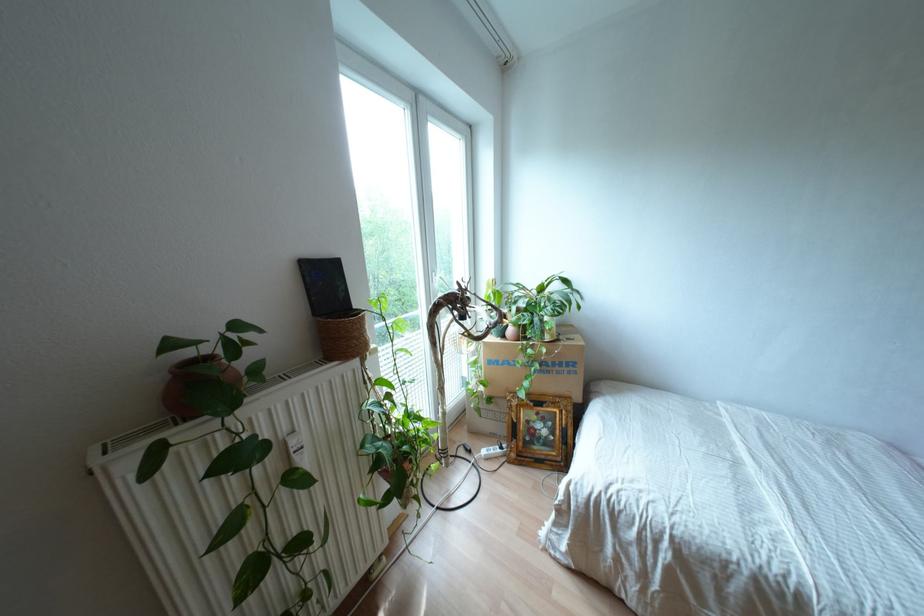
This screenshot has width=924, height=616. I want to click on dark basket lid, so click(324, 286).